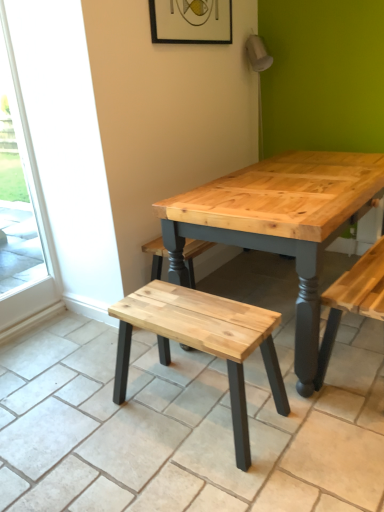
Image resolution: width=384 pixels, height=512 pixels. Find the location of `vacant area in front of natural wood stool at center`. vacant area in front of natural wood stool at center is located at coordinates (210, 476).